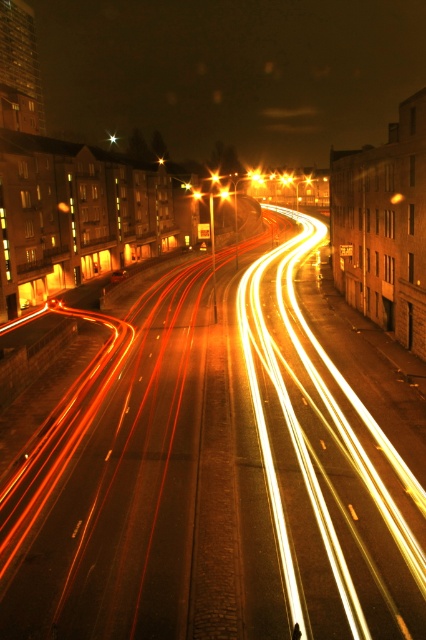
From the picture: You are a pedestrian standing at the crosswalk and see the amber glass traffic light at center and the metallic orange light at center. Which light is closer to you?

The amber glass traffic light at center is closer to you since the metallic orange light at center is positioned behind it.